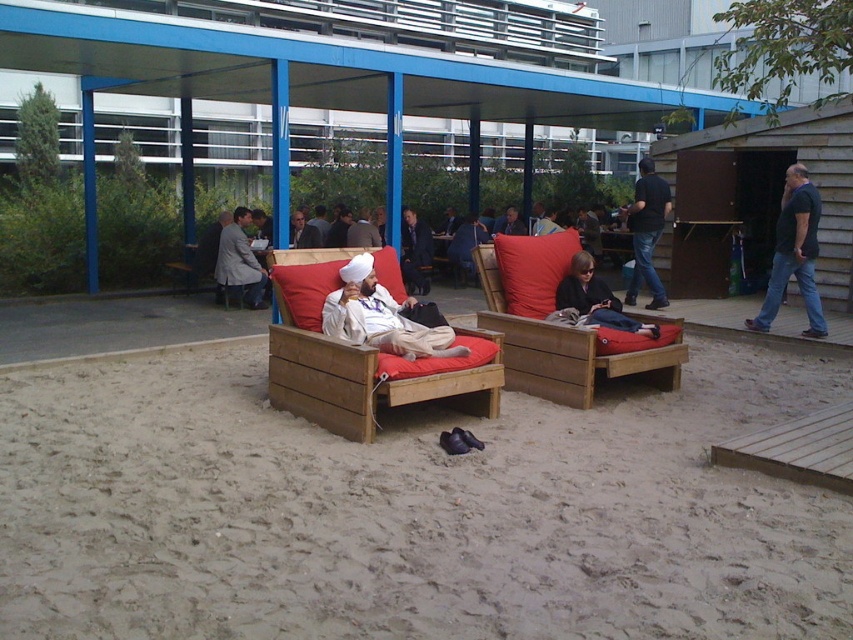
You are a photographer trying to capture a closeup shot of the dark blue jeans at center and the matte black jacket at center. Since you want to focus on both items equally, which one should you zoom in on more to ensure they appear the same size in the photo?

The dark blue jeans at center has a lesser width compared to the matte black jacket at center, so you should zoom in more on the dark blue jeans at center to make them appear the same size as the matte black jacket at center in the photo.

You are organizing a small event and need to place a decorative pillow that is 1.2 meters wide. You see the red cushion at center and the matte black jacket at center. Which object can accommodate the pillow without overlapping?

The matte black jacket at center has a greater width than the red cushion at center, so the decorative pillow can be placed on the matte black jacket at center without overlapping.

You are standing at the edge of the sandy ground in the lounge area and need to locate the dark blue jeans at center. According to the coordinates provided, in which direction should you move to find them?

The dark blue jeans at center is located at coordinates point (647, 232). Since the coordinate system typically places (0, 0) at the bottom left corner, moving towards the upper right direction from your current position at the edge of the sandy ground would help you find the dark blue jeans at center.